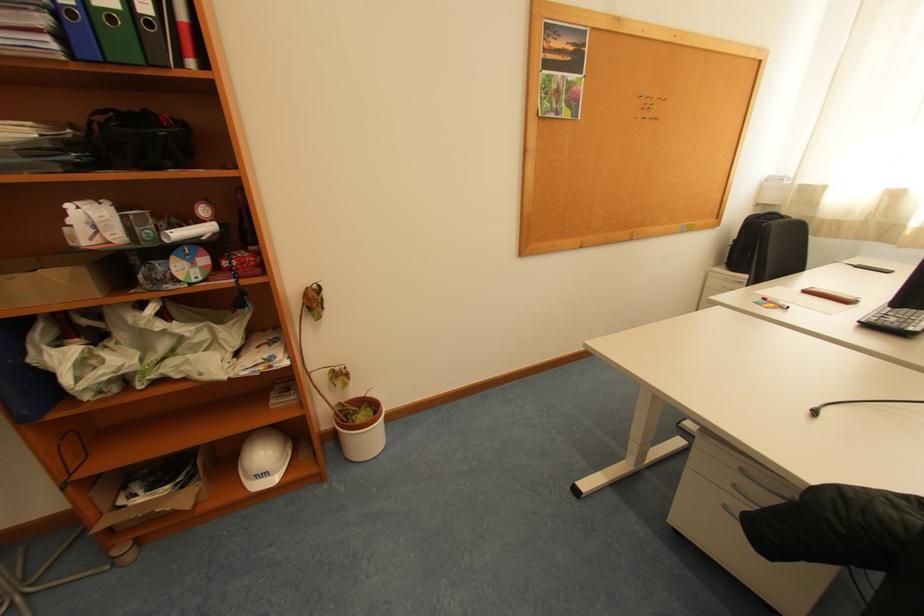
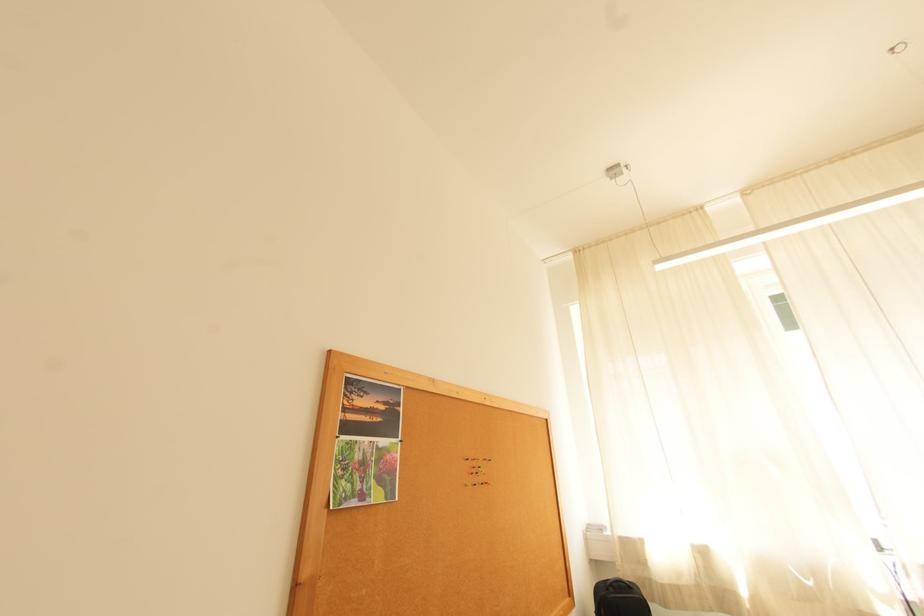
The first image is from the beginning of the video and the second image is from the end. How did the camera likely rotate when shooting the video?

The rotation direction of the camera is right-up.